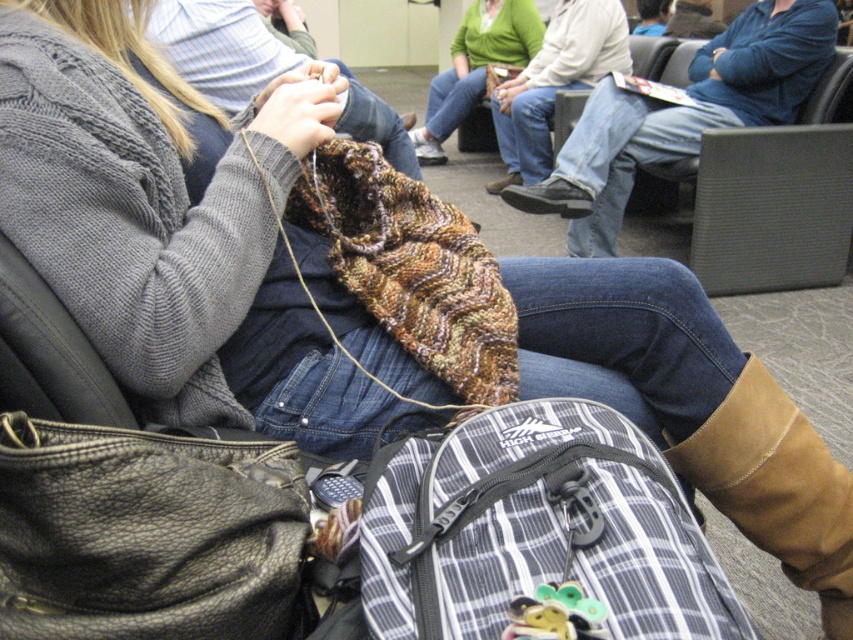
Based on the photo, you are a traveler who needs to place your brown leather boot at lower right next to the black leather bag at lower left. Based on the scene, will the boot fit horizontally next to the bag without overlapping?

The black leather bag at lower left is shorter than the brown leather boot at lower right, so the boot may not fit horizontally next to the bag without overlapping since the boot is taller.

You are a security guard in the waiting area and need to check the items in front of the person. Which item is closer to you, the blue jeans at center or the green knitted sweater at center?

The blue jeans at center is in front of the green knitted sweater at center, so the blue jeans at center is closer to you.